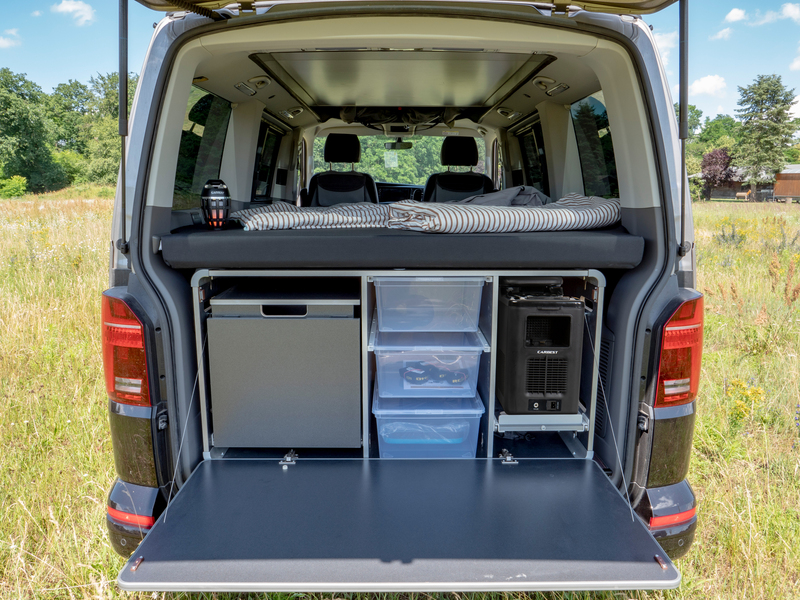
Identify the location of folded blanket. This screenshot has width=800, height=600. (486, 214).